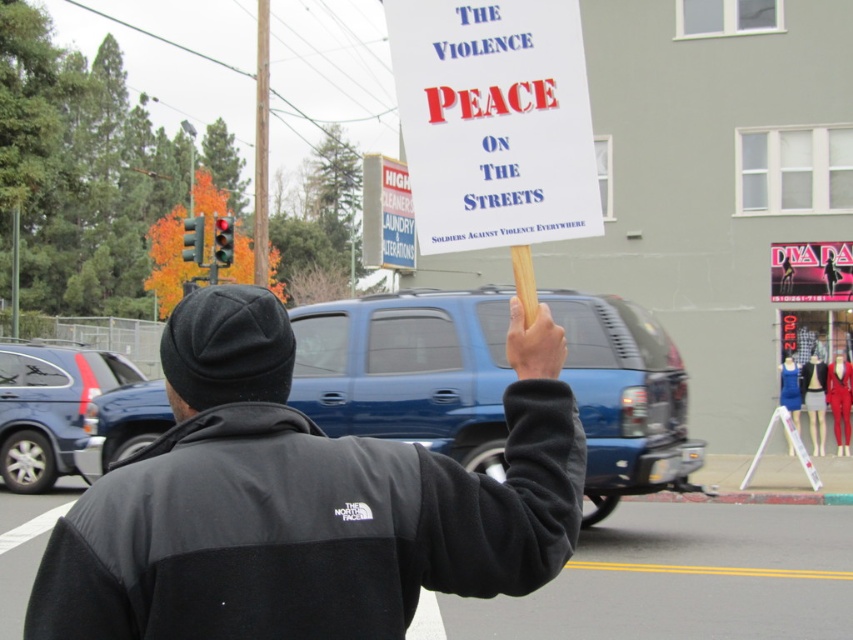
Can you confirm if black fleece jacket at center is positioned above matte blue suv at center?

Correct, black fleece jacket at center is located above matte blue suv at center.

Is point (247, 481) farther from viewer compared to point (44, 477)?

No, it is in front of (44, 477).

Find the location of a particular element. black fleece jacket at center is located at coordinates (303, 500).

Does white paper sign at upper center have a greater width compared to matte blue suv at center?

In fact, white paper sign at upper center might be narrower than matte blue suv at center.

Which of these two, white paper sign at upper center or matte blue suv at center, stands taller?

Standing taller between the two is matte blue suv at center.

Which is behind, point (514, 179) or point (26, 392)?

Point (26, 392)

The width and height of the screenshot is (853, 640). Find the location of `white paper sign at upper center`. white paper sign at upper center is located at coordinates (494, 122).

Who is positioned more to the left, black fleece jacket at center or white paper sign at upper center?

black fleece jacket at center is more to the left.

Between point (485, 545) and point (524, 22), which one is positioned in front?

Point (485, 545) is more forward.

Locate an element on the screen. The height and width of the screenshot is (640, 853). black fleece jacket at center is located at coordinates (303, 500).